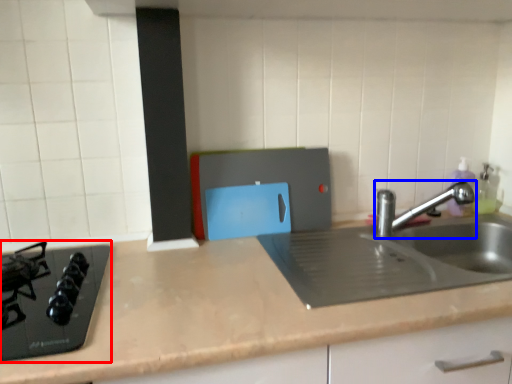
Question: Which of the following is the farthest to the observer, gas stove (highlighted by a red box) or tap (highlighted by a blue box)?

Choices:
 (A) gas stove
 (B) tap

Answer: (B)